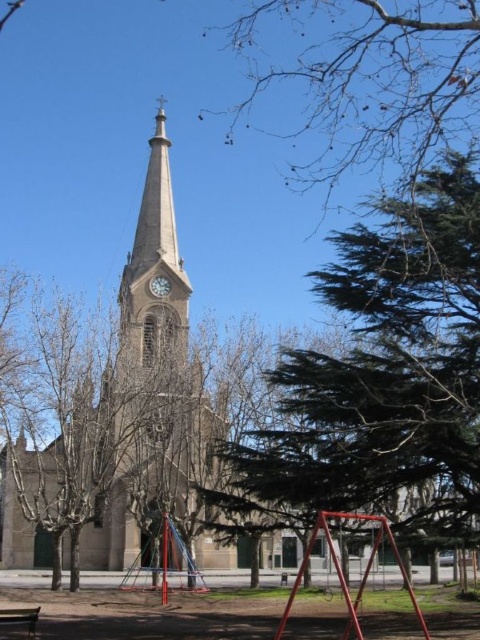
Is green leafy tree at upper center above wooden park bench at lower left?

Correct, green leafy tree at upper center is located above wooden park bench at lower left.

Is green leafy tree at upper center bigger than wooden park bench at lower left?

Correct, green leafy tree at upper center is larger in size than wooden park bench at lower left.

I want to click on green leafy tree at upper center, so [373, 80].

Who is higher up, green needle-like leaves at center or metallic clock at upper center?

metallic clock at upper center is above.

Does green needle-like leaves at center have a larger size compared to metallic clock at upper center?

Correct, green needle-like leaves at center is larger in size than metallic clock at upper center.

Who is more distant from viewer, (456, 161) or (154, 276)?

The point (154, 276) is behind.

Find the location of a particular element. This screenshot has height=640, width=480. green needle-like leaves at center is located at coordinates tap(385, 372).

Consider the image. Is green leafy tree at upper center above metallic clock at upper center?

Yes, green leafy tree at upper center is above metallic clock at upper center.

Is green leafy tree at upper center wider than metallic clock at upper center?

Yes.

Between point (395, 109) and point (154, 280), which one is positioned behind?

The point (154, 280) is behind.

Where is `green leafy tree at upper center`? Image resolution: width=480 pixels, height=640 pixels. green leafy tree at upper center is located at coordinates (373, 80).